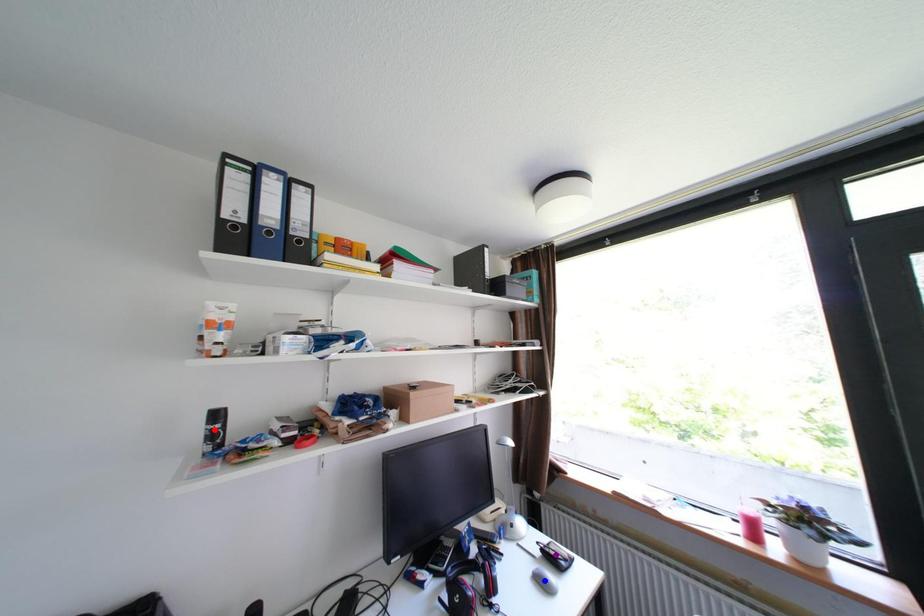
Order these from nearest to farthest:
A) red point
B) purple point
C) blue point

red point → blue point → purple point